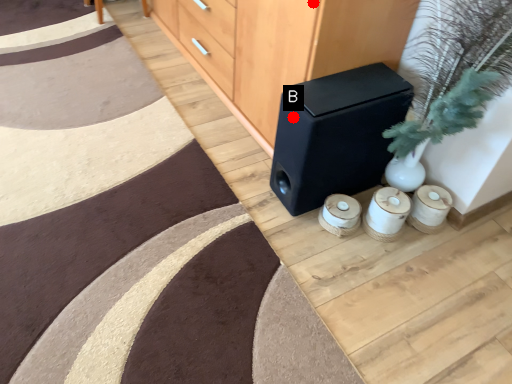
Question: Two points are circled on the image, labeled by A and B beside each circle. Which of the following is the farthest from the observer?

Choices:
 (A) A is further
 (B) B is further

Answer: (B)